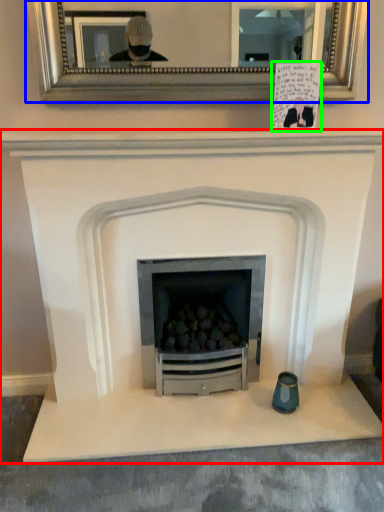
Question: Which object is the closest to the fireplace (highlighted by a red box)? Choose among these: picture frame (highlighted by a blue box) or postcard (highlighted by a green box).

Choices:
 (A) picture frame
 (B) postcard

Answer: (B)